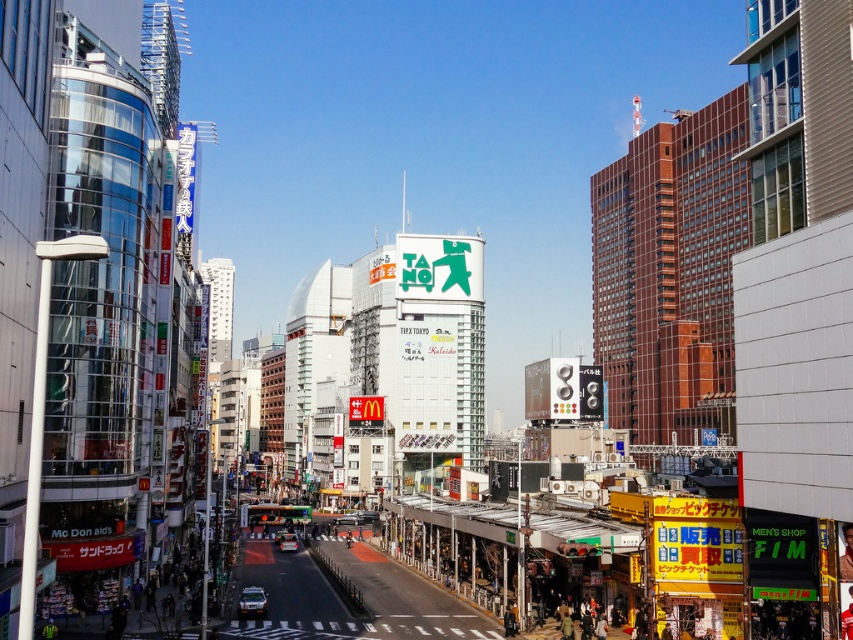
Can you confirm if shiny silver car at center is bigger than silver metallic car at center?

No, shiny silver car at center is not bigger than silver metallic car at center.

Can you confirm if shiny silver car at center is shorter than silver metallic car at center?

Yes.

Identify the location of shiny silver car at center. The height and width of the screenshot is (640, 853). (288, 541).

Can you confirm if silver metallic car at lower left is thinner than silver metallic car at center?

Indeed, silver metallic car at lower left has a lesser width compared to silver metallic car at center.

Identify the location of silver metallic car at lower left. (252, 602).

Which is behind, point (253, 609) or point (340, 520)?

The point (340, 520) is more distant.

The width and height of the screenshot is (853, 640). I want to click on silver metallic car at lower left, so click(252, 602).

Who is higher up, silver metallic car at lower left or shiny silver car at center?

silver metallic car at lower left is above.

Is silver metallic car at lower left above shiny silver car at center?

Yes.

Which is behind, point (254, 593) or point (296, 541)?

Positioned behind is point (296, 541).

This screenshot has height=640, width=853. What are the coordinates of `silver metallic car at lower left` in the screenshot? It's located at (252, 602).